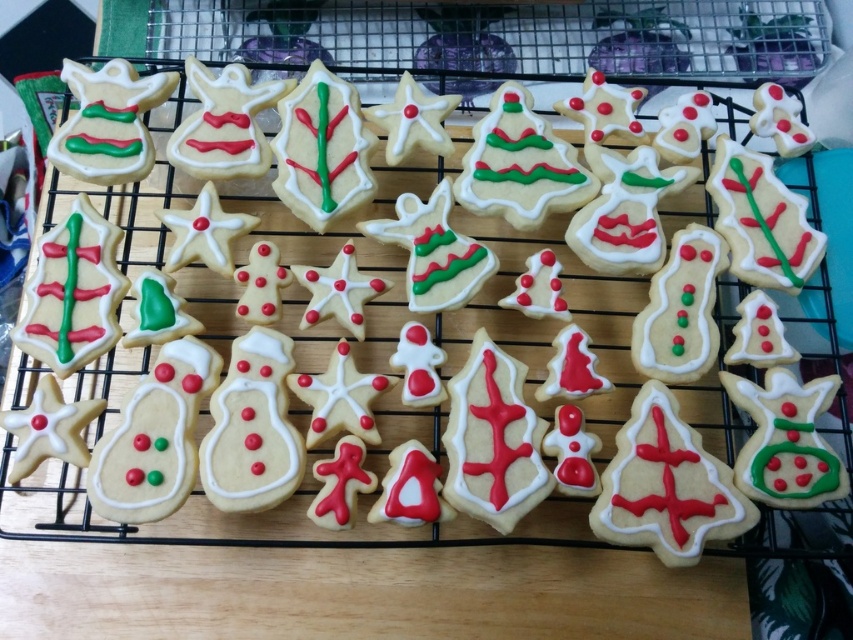
You are a baker who wants to place a 5 inch wide ribbon between the white glossy christmas tree at center and the matte white gingerbread at center. Is there enough space between them to fit the ribbon?

The white glossy christmas tree at center and matte white gingerbread at center are 5.18 inches apart from each other. Since the ribbon is 5 inches wide, there is enough space between them to fit the ribbon as 5.18 inches is greater than 5 inches.

You are a baker arranging cookies on a cooling rack. You have the white glossy christmas tree at center and the matte white gingerbread at center. Which cookie is closer to you when looking at the arrangement?

The white glossy christmas tree at center is closer to you because it is in front of the matte white gingerbread at center.